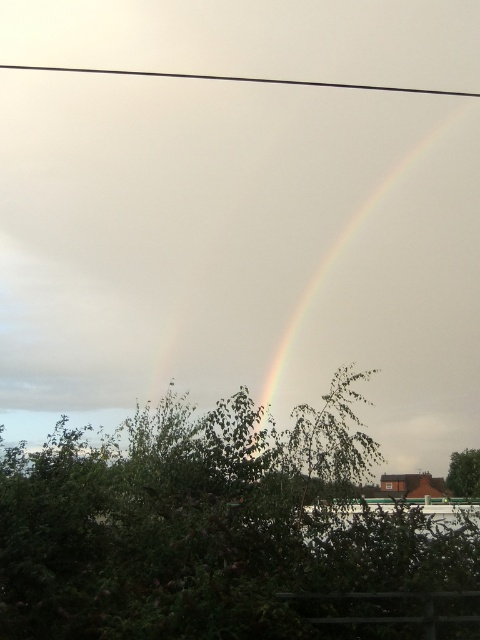
Question: Can you confirm if green leafy tree at center is wider than black wire at upper center?

Choices:
 (A) no
 (B) yes

Answer: (A)

Question: Based on their relative distances, which object is farther from the green leafy tree at lower right?

Choices:
 (A) black wire at upper center
 (B) green leafy tree at center

Answer: (A)

Question: Can you confirm if green leafy tree at center is positioned to the right of black wire at upper center?

Choices:
 (A) yes
 (B) no

Answer: (B)

Question: Does green leafy tree at center come behind green leafy tree at lower right?

Choices:
 (A) no
 (B) yes

Answer: (A)

Question: Which object is farther from the camera taking this photo?

Choices:
 (A) black wire at upper center
 (B) rainbow at upper center
 (C) green leafy tree at center
 (D) green leafy tree at lower right

Answer: (A)

Question: Which point is closer to the camera?

Choices:
 (A) (328, 448)
 (B) (362, 276)
 (C) (218, 80)
 (D) (477, 456)

Answer: (A)